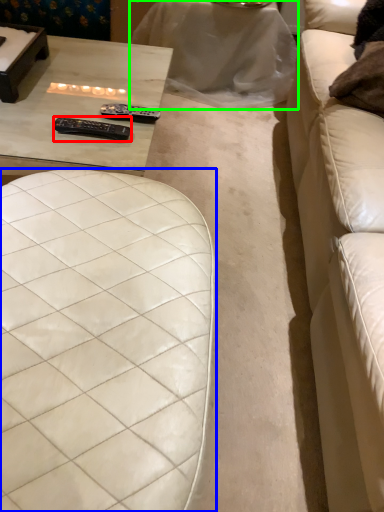
Question: Which object is positioned farthest from remote (highlighted by a red box)? Select from furniture (highlighted by a blue box) and table (highlighted by a green box).

Choices:
 (A) furniture
 (B) table

Answer: (B)